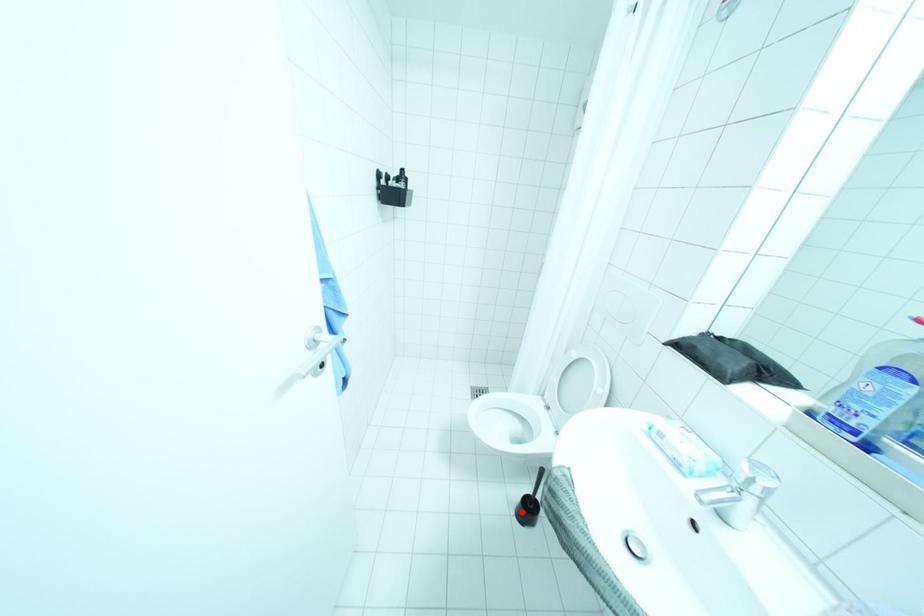
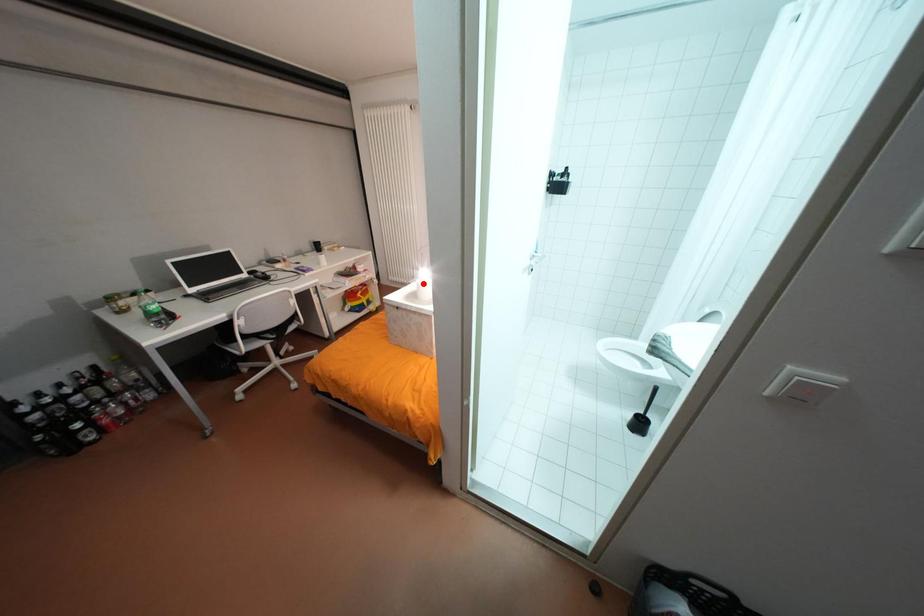
I am providing you with two images of the same scene from different viewpoints. A red point is marked on the first image and another point is marked on the second image. Are the points marked in image1 and image2 representing the same 3D position?

No